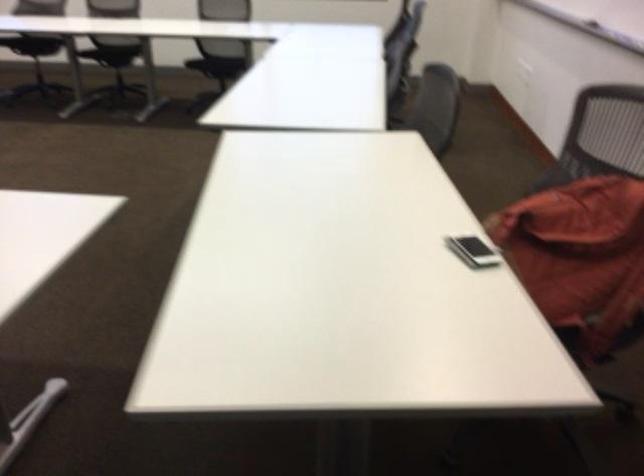
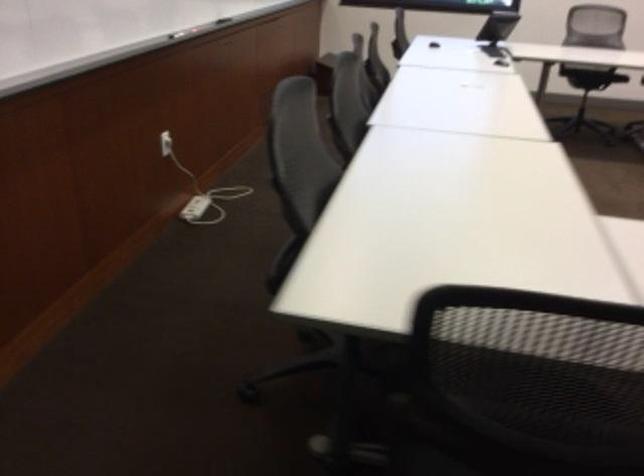
Question: Which direction would the cameraman need to move to produce the second image? Reply with the corresponding letter.

Choices:
 (A) Left
 (B) Right
 (C) Forward
 (D) Backward

Answer: (A)